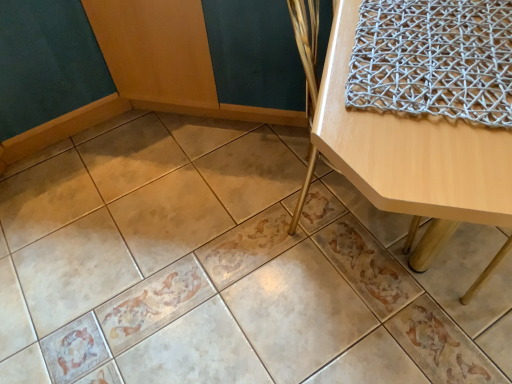
Describe the element at coordinates (406, 151) in the screenshot. I see `light wood/matte table at upper right` at that location.

Locate an element on the screen. light wood/matte table at upper right is located at coordinates (406, 151).

The height and width of the screenshot is (384, 512). In order to click on light wood/matte table at upper right in this screenshot , I will do `click(406, 151)`.